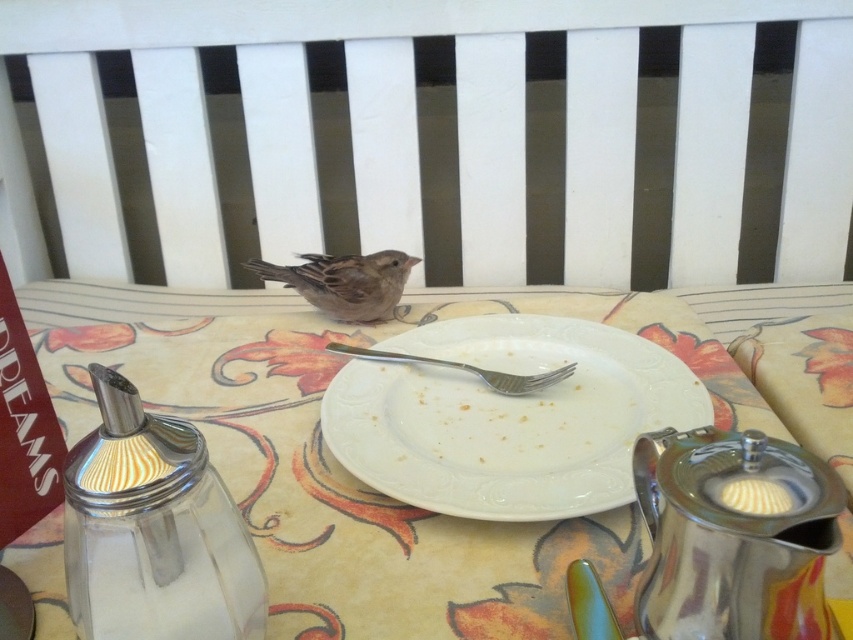
Question: Can you confirm if white ceramic plate at center is smaller than white porcelain plate at center?

Choices:
 (A) yes
 (B) no

Answer: (B)

Question: Is white porcelain plate at center bigger than satin silver fork at center?

Choices:
 (A) yes
 (B) no

Answer: (A)

Question: Based on their relative distances, which object is nearer to the white ceramic plate at center?

Choices:
 (A) white porcelain plate at center
 (B) brown feathered sparrow at center
 (C) satin silver fork at center

Answer: (A)

Question: Which point appears farthest from the camera in this image?

Choices:
 (A) (544, 355)
 (B) (346, 257)

Answer: (B)

Question: From the image, what is the correct spatial relationship of white porcelain plate at center in relation to brown feathered sparrow at center?

Choices:
 (A) left
 (B) right

Answer: (B)

Question: Which object is the farthest from the satin silver fork at center?

Choices:
 (A) brown feathered sparrow at center
 (B) white ceramic plate at center

Answer: (B)